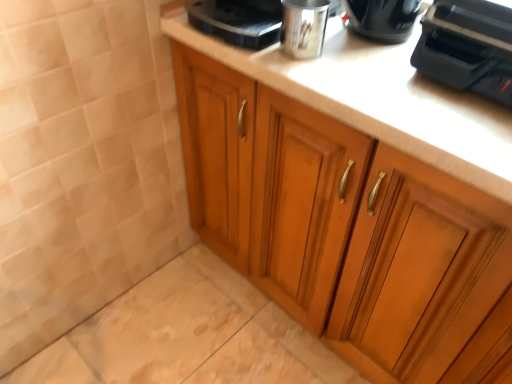
At what (x,y) coordinates should I click in order to perform the action: click on wooden cabinet at center. Please return your answer as a coordinate pair (x, y). This screenshot has width=512, height=384. Looking at the image, I should click on (340, 225).

Image resolution: width=512 pixels, height=384 pixels. What do you see at coordinates (340, 225) in the screenshot?
I see `wooden cabinet at center` at bounding box center [340, 225].

Measure the distance between wooden cabinet at center and camera.

wooden cabinet at center is 25.72 inches from camera.

Describe the element at coordinates (468, 47) in the screenshot. Image resolution: width=512 pixels, height=384 pixels. I see `black plastic toaster at upper right` at that location.

Identify the location of black plastic toaster at upper right. The image size is (512, 384). (468, 47).

Locate an element on the screen. Image resolution: width=512 pixels, height=384 pixels. wooden cabinet at center is located at coordinates (340, 225).

Does black plastic toaster at upper right appear on the right side of wooden cabinet at center?

Correct, you'll find black plastic toaster at upper right to the right of wooden cabinet at center.

Who is more distant, black plastic toaster at upper right or wooden cabinet at center?

black plastic toaster at upper right is behind.

Between point (490, 6) and point (245, 113), which one is positioned in front?

The point (490, 6) is in front.

From the image's perspective, which object appears higher, black plastic toaster at upper right or wooden cabinet at center?

From the image's view, black plastic toaster at upper right is above.

From a real-world perspective, which object stands above the other?

black plastic toaster at upper right.

Is black plastic toaster at upper right wider than wooden cabinet at center?

Incorrect, the width of black plastic toaster at upper right does not surpass that of wooden cabinet at center.

Between black plastic toaster at upper right and wooden cabinet at center, which one has more height?

wooden cabinet at center is taller.

Considering the relative sizes of black plastic toaster at upper right and wooden cabinet at center in the image provided, is black plastic toaster at upper right smaller than wooden cabinet at center?

Yes.

Choose the correct answer: Is black plastic toaster at upper right inside wooden cabinet at center or outside it?

black plastic toaster at upper right is outside wooden cabinet at center.

Does black plastic toaster at upper right touch wooden cabinet at center?

No.

Based on the photo, is black plastic toaster at upper right oriented away from wooden cabinet at center?

No.

Can you tell me how much black plastic toaster at upper right and wooden cabinet at center differ in facing direction?

black plastic toaster at upper right and wooden cabinet at center are facing 6.16 degrees away from each other.

Locate an element on the screen. home appliance behind the wooden cabinet at center is located at coordinates (468, 47).

Is wooden cabinet at center to the left of black plastic toaster at upper right from the viewer's perspective?

Correct, you'll find wooden cabinet at center to the left of black plastic toaster at upper right.

Between wooden cabinet at center and black plastic toaster at upper right, which one is positioned behind?

black plastic toaster at upper right is further from the camera.

Does point (359, 235) come farther from viewer compared to point (440, 9)?

Yes, it is.

From the image's perspective, who appears lower, wooden cabinet at center or black plastic toaster at upper right?

wooden cabinet at center, from the image's perspective.

From a real-world perspective, is wooden cabinet at center positioned under black plastic toaster at upper right based on gravity?

Indeed, from a real-world perspective, wooden cabinet at center is positioned beneath black plastic toaster at upper right.

In terms of width, does wooden cabinet at center look wider or thinner when compared to black plastic toaster at upper right?

In the image, wooden cabinet at center appears to be wider than black plastic toaster at upper right.

Considering the sizes of objects wooden cabinet at center and black plastic toaster at upper right in the image provided, who is shorter, wooden cabinet at center or black plastic toaster at upper right?

With less height is black plastic toaster at upper right.

Between wooden cabinet at center and black plastic toaster at upper right, which one has larger size?

wooden cabinet at center.

Is black plastic toaster at upper right a part of wooden cabinet at center?

No, black plastic toaster at upper right is located outside of wooden cabinet at center.

Is wooden cabinet at center positioned far away from black plastic toaster at upper right?

No, wooden cabinet at center is not far from black plastic toaster at upper right.

Is wooden cabinet at center oriented towards black plastic toaster at upper right?

No, wooden cabinet at center is not aimed at black plastic toaster at upper right.

Measure the distance from wooden cabinet at center to black plastic toaster at upper right.

wooden cabinet at center is 16.18 inches away from black plastic toaster at upper right.

Where is `home appliance that appears behind the wooden cabinet at center`? The height and width of the screenshot is (384, 512). home appliance that appears behind the wooden cabinet at center is located at coordinates (468, 47).

In the image, there is a black plastic toaster at upper right. What are the coordinates of `cabinetry below it (from a real-world perspective)` in the screenshot? It's located at (340, 225).

This screenshot has height=384, width=512. I want to click on cabinetry that appears in front of the black plastic toaster at upper right, so click(x=340, y=225).